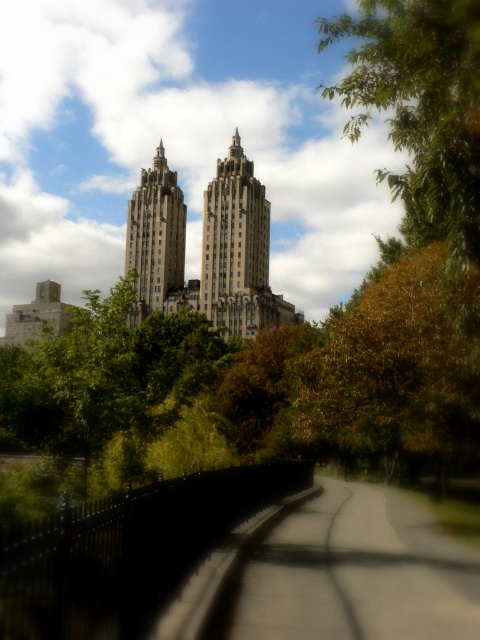
Question: Does smooth asphalt path at center appear over green leafy tree at upper right?

Choices:
 (A) yes
 (B) no

Answer: (B)

Question: Can you confirm if smooth asphalt path at center is smaller than beige stone tower at center?

Choices:
 (A) yes
 (B) no

Answer: (B)

Question: Considering the real-world distances, which object is closest to the matte stone building at center?

Choices:
 (A) green leafy tree at upper right
 (B) beige stone tower at center
 (C) smooth asphalt path at center

Answer: (B)

Question: Which object is closer to the camera taking this photo?

Choices:
 (A) green leafy tree at upper right
 (B) brown leafy tree at center

Answer: (A)

Question: Based on their relative distances, which object is nearer to the brown leafy tree at center?

Choices:
 (A) matte stone building at center
 (B) beige stone tower at center
 (C) green leafy tree at upper right
 (D) smooth asphalt path at center

Answer: (D)

Question: Does brown leafy tree at center appear over green leafy tree at upper right?

Choices:
 (A) no
 (B) yes

Answer: (A)